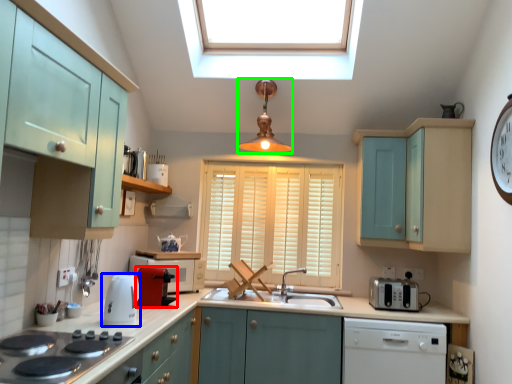
Question: Estimate the real-world distances between objects in this image. Which object is closer to coffee machine (highlighted by a red box), kitchen appliance (highlighted by a blue box) or light fixture (highlighted by a green box)?

Choices:
 (A) kitchen appliance
 (B) light fixture

Answer: (A)